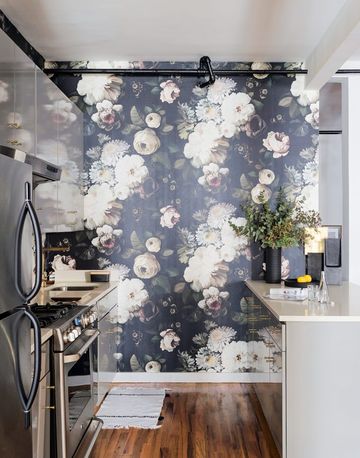
You are a GUI agent. You are given a task and a screenshot of the screen. Output one action in this format:
    pyautogui.click(x=<x>, y=<y>)
    Task: Click on the plant
    The height and width of the screenshot is (458, 360).
    Given the screenshot: What is the action you would take?
    pyautogui.click(x=275, y=228)